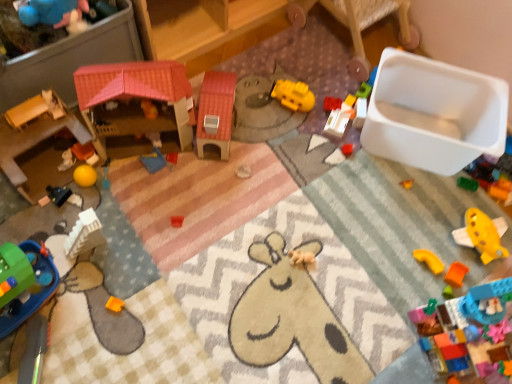
Where is `empty space that is in between yellow matte plastic toy at center, which is the 8th toy from right to left, and plastic pink house at center, the 7th toy in the left-to-right sequence`? empty space that is in between yellow matte plastic toy at center, which is the 8th toy from right to left, and plastic pink house at center, the 7th toy in the left-to-right sequence is located at coordinates (260, 122).